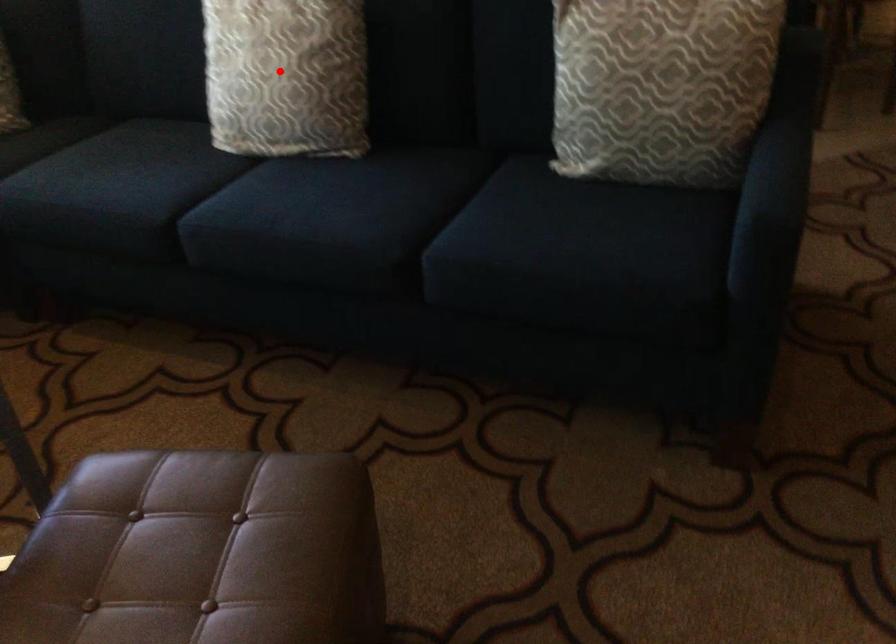
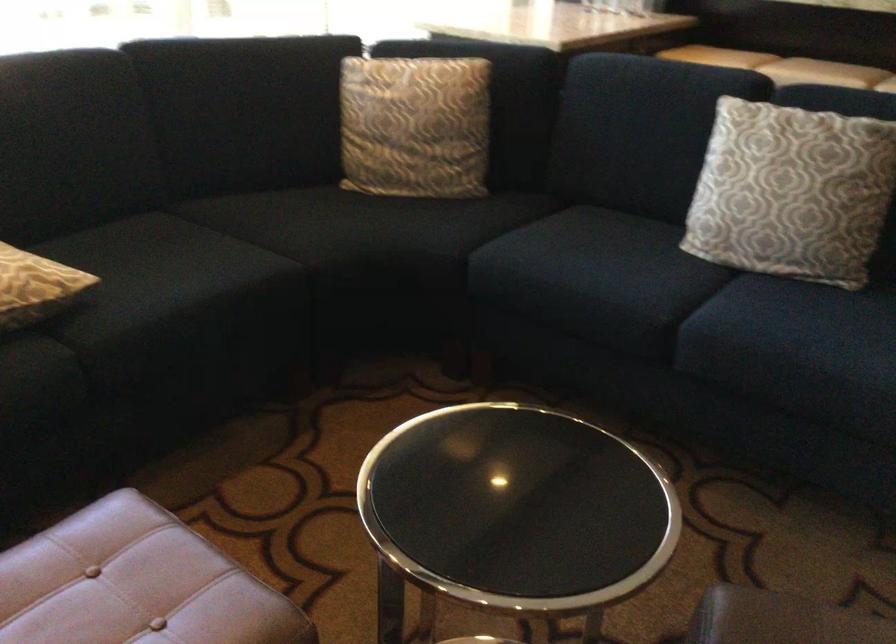
Find the pixel in the second image that matches the highlighted location in the first image.

(791, 192)